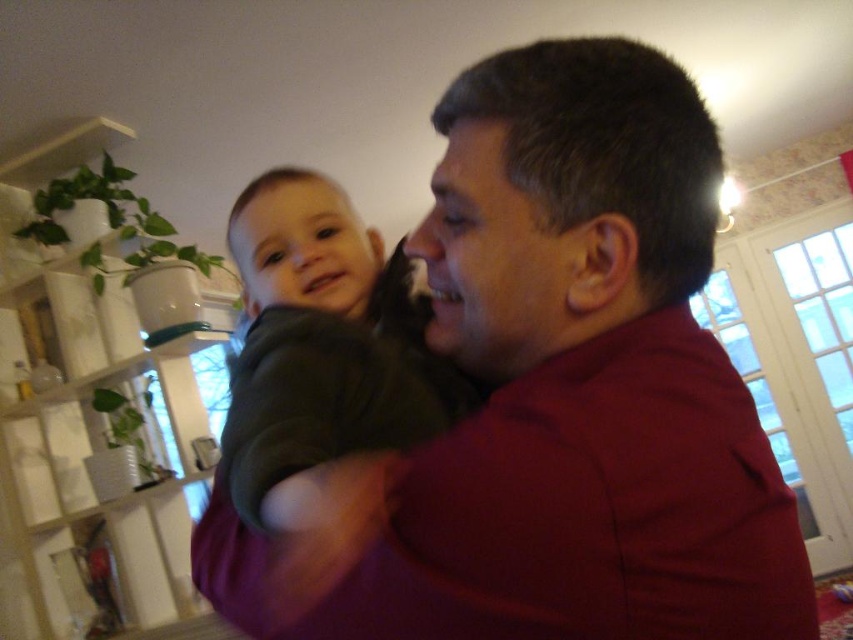
You are a photographer adjusting your camera to focus on two points in the image. The first point is at coordinates point (764, 589) and the second is at point (294, 429). Which point should you focus on first if you want to capture the closest object in the scene?

Point (764, 589) is closer to the camera than point (294, 429), so you should focus on point (764, 589) first to capture the closest object in the scene.

You are a fashion designer observing the scene. You need to determine which clothing item, the matte red shirt at center or the dark green sweater at center, has a larger width for designing a new collection. Based on the scene, which one should you consider?

The matte red shirt at center has a larger width than the dark green sweater at center, so you should consider the matte red shirt at center for designing a new collection with wider cuts.